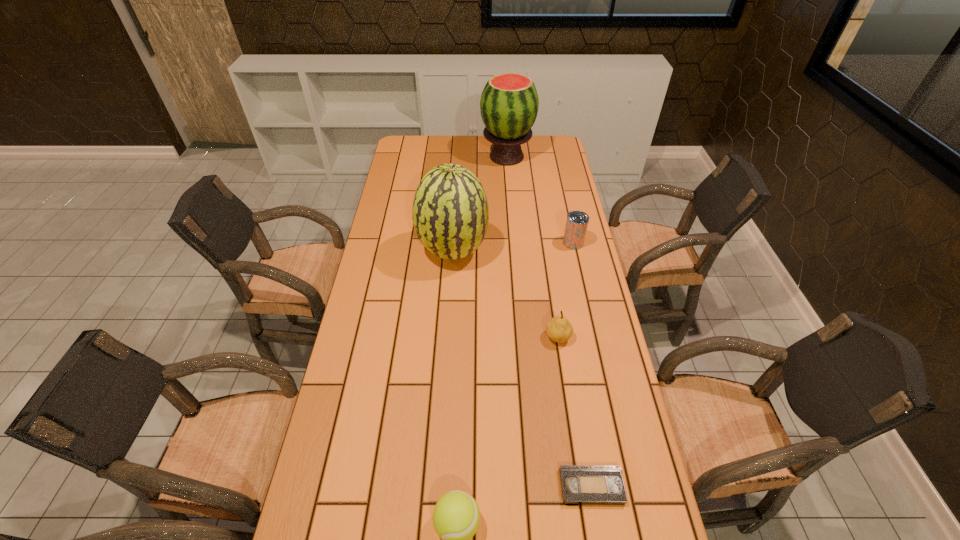
The width and height of the screenshot is (960, 540). What are the coordinates of `object positioned at the far edge` in the screenshot? It's located at (509, 103).

This screenshot has height=540, width=960. I want to click on watermelon positioned at the right edge, so click(x=509, y=103).

Locate an element on the screen. The image size is (960, 540). beer can at the right edge is located at coordinates (576, 225).

I want to click on pear situated at the right edge, so click(x=559, y=329).

You are a GUI agent. You are given a task and a screenshot of the screen. Output one action in this format:
    pyautogui.click(x=<x>, y=<y>)
    Task: Click on the videotape that is at the right edge
    This screenshot has width=960, height=540.
    Given the screenshot: What is the action you would take?
    pyautogui.click(x=581, y=484)

I want to click on object situated at the far right corner, so tap(509, 103).

Locate an element on the screen. The image size is (960, 540). free space at the far edge of the desktop is located at coordinates (456, 158).

Where is `vacant space at the left edge of the desktop`? Image resolution: width=960 pixels, height=540 pixels. vacant space at the left edge of the desktop is located at coordinates (333, 404).

Where is `blank space at the right edge`? The width and height of the screenshot is (960, 540). blank space at the right edge is located at coordinates (644, 526).

At what (x,y) coordinates should I click in order to perform the action: click on vacant space at the far left corner of the desktop. Please return your answer as a coordinate pair (x, y). This screenshot has width=960, height=540. Looking at the image, I should click on (420, 147).